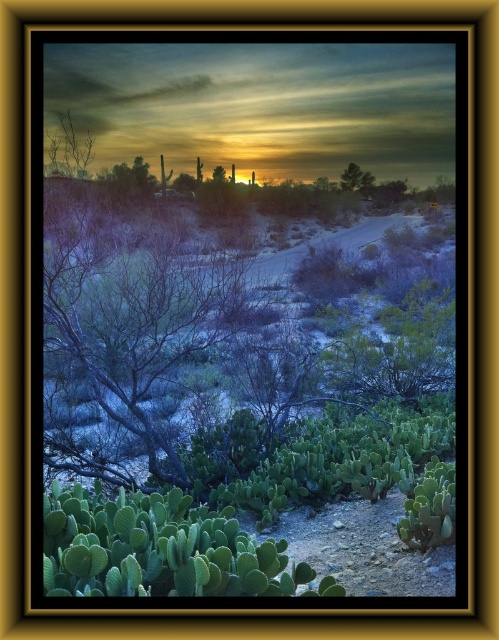
Question: Is bare branches at upper left closer to camera compared to green leafy cactus at center?

Choices:
 (A) yes
 (B) no

Answer: (A)

Question: Is green leafy tree at upper center positioned in front of green leafy cactus at center?

Choices:
 (A) yes
 (B) no

Answer: (B)

Question: Which of the following is the closest to the observer?

Choices:
 (A) (66, 132)
 (B) (350, 166)
 (C) (224, 173)

Answer: (A)

Question: Which point is farther to the camera?

Choices:
 (A) (62, 145)
 (B) (220, 166)

Answer: (B)

Question: Which of the following is the closest to the observer?

Choices:
 (A) green leafy cactus at center
 (B) bare branches at upper left
 (C) green leafy tree at upper center

Answer: (B)

Question: Does green leafy tree at upper center have a smaller size compared to green leafy cactus at center?

Choices:
 (A) no
 (B) yes

Answer: (A)